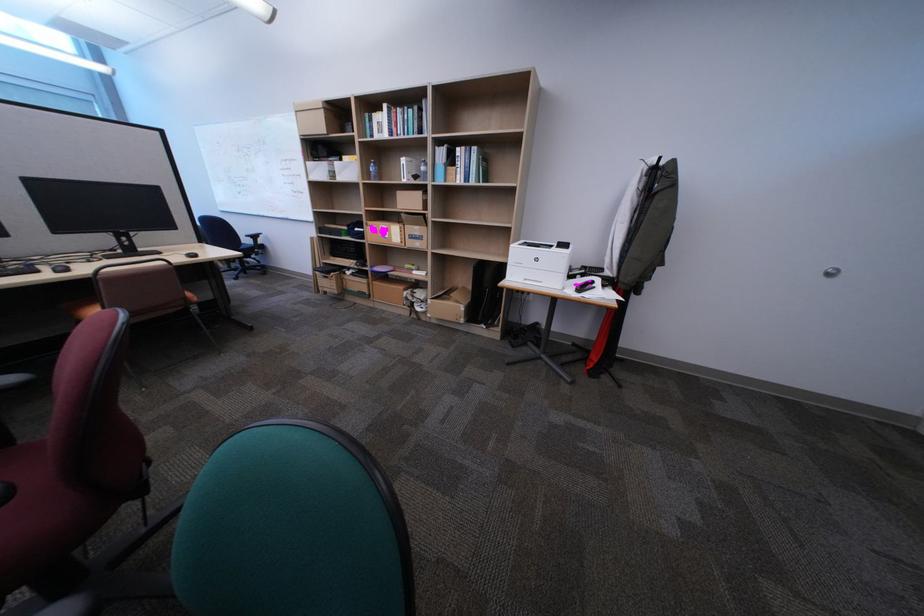
Locate an element on the screen. This screenshot has width=924, height=616. red chair sitting surface is located at coordinates pos(22,471).